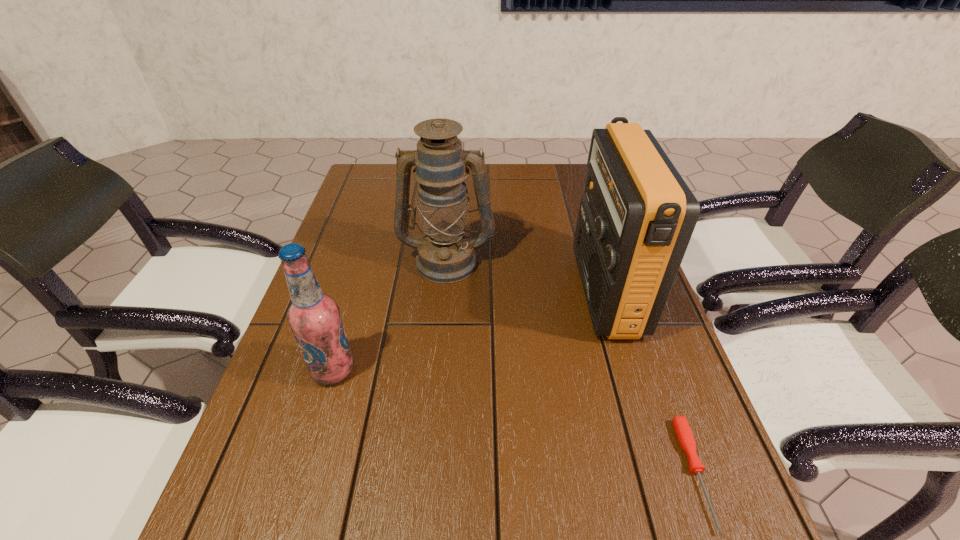
Identify the location of vacant space located 0.180m on the back of the leftmost object. The height and width of the screenshot is (540, 960). (356, 295).

The width and height of the screenshot is (960, 540). What are the coordinates of `object present at the near edge` in the screenshot? It's located at (682, 429).

Identify the location of object that is positioned at the left edge. This screenshot has height=540, width=960. (314, 318).

I want to click on radio receiver that is at the right edge, so click(636, 218).

Identify the location of screwdriver located in the right edge section of the desktop. (682, 429).

This screenshot has width=960, height=540. Identify the location of object that is positioned at the near right corner. coord(682,429).

The width and height of the screenshot is (960, 540). Identify the location of free location at the far edge. (493, 188).

In the image, there is a desktop. Find the location of `free region at the left edge`. free region at the left edge is located at coordinates point(252,494).

The height and width of the screenshot is (540, 960). In the image, there is a desktop. What are the coordinates of `vacant space at the right edge` in the screenshot? It's located at (621, 431).

The height and width of the screenshot is (540, 960). Find the location of `blank space at the far left corner of the desktop`. blank space at the far left corner of the desktop is located at coordinates (353, 190).